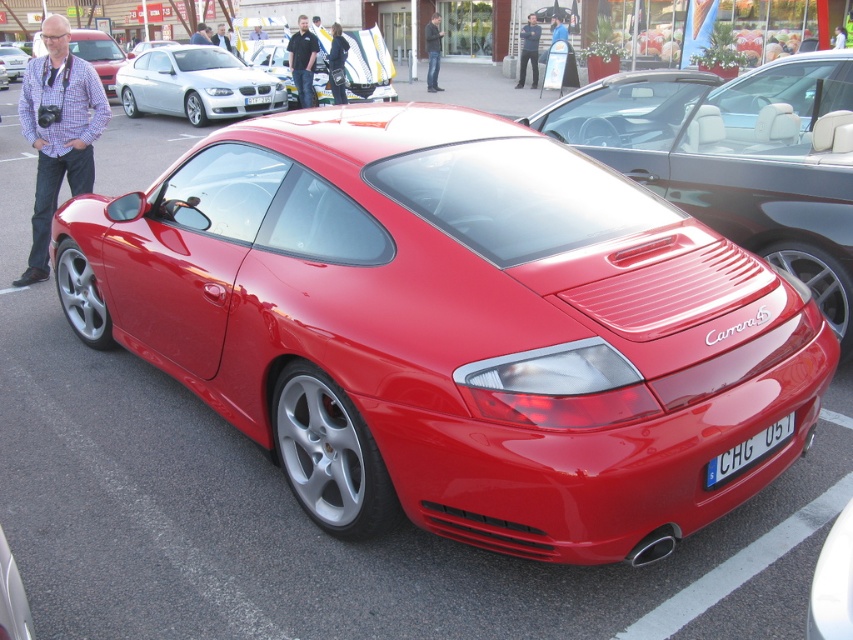
Looking at this image, you are a photographer trying to capture the entire shiny metallic red sports car at center and the blue metallic license plate at rear in a single frame. Considering their sizes, will the license plate be smaller in the photo compared to the car?

The shiny metallic red sports car at center is bigger than the blue metallic license plate at rear, so yes, the license plate will appear smaller in the photo compared to the car.

You are a photographer at a car exhibition. You need to capture a clear shot of the sleek silver coupe at upper left without the matte black car at left blocking it. Can you move forward to achieve this?

The sleek silver coupe at upper left is in front of the matte black car at left, so moving forward will keep the matte black car at left behind and out of the frame, allowing a clear shot of the sleek silver coupe at upper left.

You are a photographer trying to capture the entire shiny metallic red sports car at center and the blue metallic license plate at rear in one frame. Considering their height difference, which object will appear larger in your photo?

The shiny metallic red sports car at center will appear larger in the photo because it is much taller than the blue metallic license plate at rear.